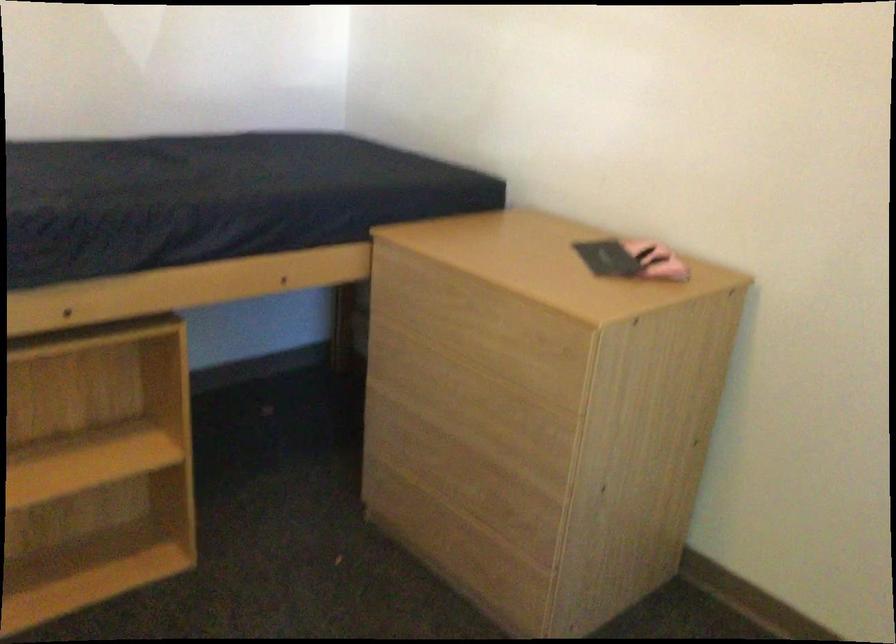
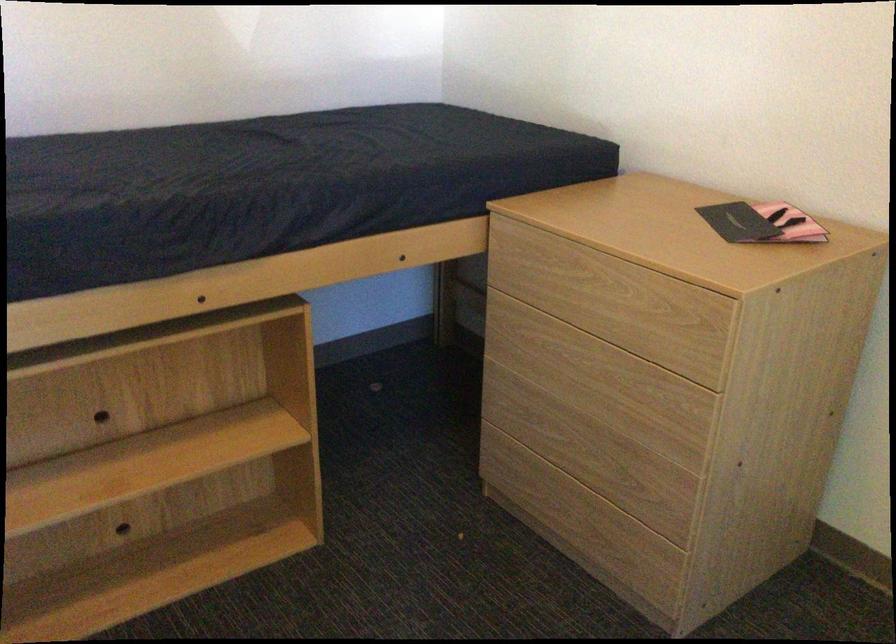
Find the pixel in the second image that matches point 479,489 in the first image.

(607, 464)